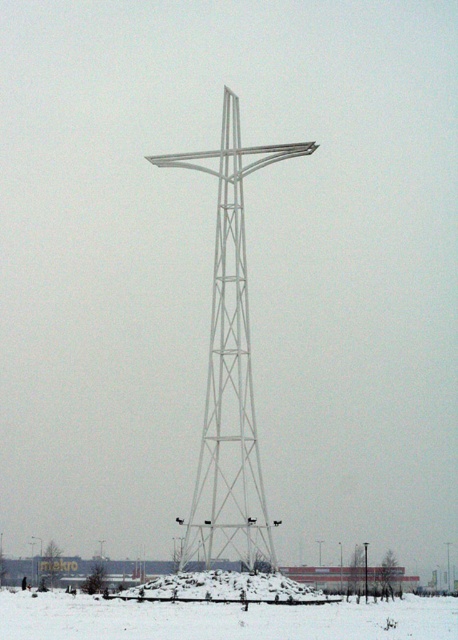
Question: Is white metallic cross at center to the left of white metallic pole at center from the viewer's perspective?

Choices:
 (A) yes
 (B) no

Answer: (A)

Question: Which object appears farthest from the camera in this image?

Choices:
 (A) white metallic cross at center
 (B) white metallic pole at center
 (C) white powdery snow at center

Answer: (B)

Question: Is white metallic cross at center to the left of white metallic pole at center from the viewer's perspective?

Choices:
 (A) no
 (B) yes

Answer: (B)

Question: Where is white metallic cross at center located in relation to white powdery snow at center in the image?

Choices:
 (A) left
 (B) right

Answer: (B)

Question: Which is farther from the white powdery snow at center?

Choices:
 (A) white metallic pole at center
 (B) white metallic cross at center

Answer: (A)

Question: Which object is closer to the camera taking this photo?

Choices:
 (A) white powdery snow at center
 (B) white metallic cross at center
 (C) white metallic pole at center

Answer: (A)